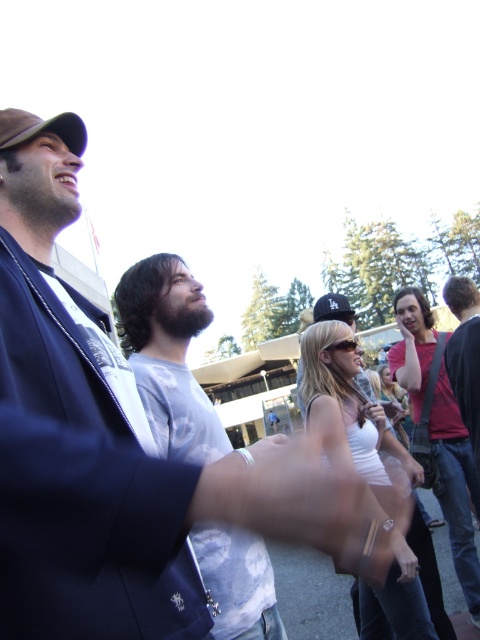
What are the coordinates of the brown fabric baseball cap at upper left in the image?

The coordinates of the brown fabric baseball cap at upper left are at point (x=40, y=129).

You are standing in the gathering and want to move towards the two points in the image. Which point, point (34, 122) or point (346, 298), is closer to you?

Point (34, 122) is closer to the viewer than point (346, 298).